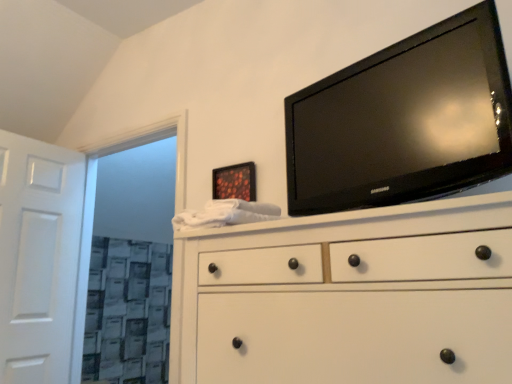
Question: From the image's perspective, is white wooden door at left positioned above or below white matte chest of drawers at center?

Choices:
 (A) below
 (B) above

Answer: (A)

Question: Does point (15, 382) appear closer or farther from the camera than point (352, 218)?

Choices:
 (A) closer
 (B) farther

Answer: (B)

Question: Estimate the real-world distances between objects in this image. Which object is closer to the white wooden door at left?

Choices:
 (A) white matte chest of drawers at center
 (B) black glossy tv at upper right
 (C) white textured glass door at left

Answer: (C)

Question: Considering the real-world distances, which object is closest to the white wooden door at left?

Choices:
 (A) white matte chest of drawers at center
 (B) white textured glass door at left
 (C) black glossy tv at upper right

Answer: (B)